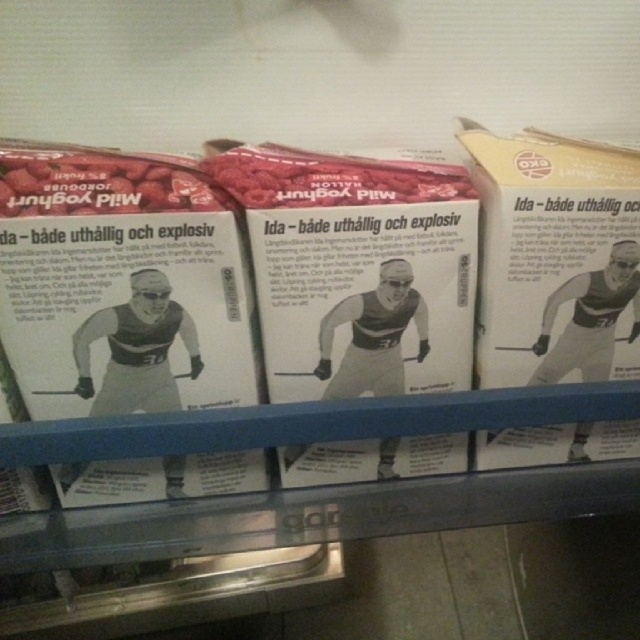
You are organizing a sports nutrition booth and have these two items to display. The white paperboard box at right contains a brochure, and the matte white yogurt at left holds a sample. Which item should you place in a more prominent position if you want to draw attention to the brochure first?

The white paperboard box at right is bigger than the matte white yogurt at left, so placing it in a more prominent position will naturally draw attention to the brochure first due to its larger size.

You are standing in front of a shelf with three cartons of yogurt arranged side by side. Each carton has a photo of a cross country skier and text in Swedish. You need to reach for the carton located at point (563, 278) and the one at point (129, 204). Which carton will you need to move first to access the other?

Point (563, 278) is behind point (129, 204), so you must move the carton at point (129, 204) first to access the one behind it at point (563, 278).

You are organizing a pantry and notice the white paperboard box at right and the raspberry matte at center on a shelf. Which item is closer to you as you face the shelf?

The white paperboard box at right is closer to you because it is further to the viewer than the raspberry matte at center.